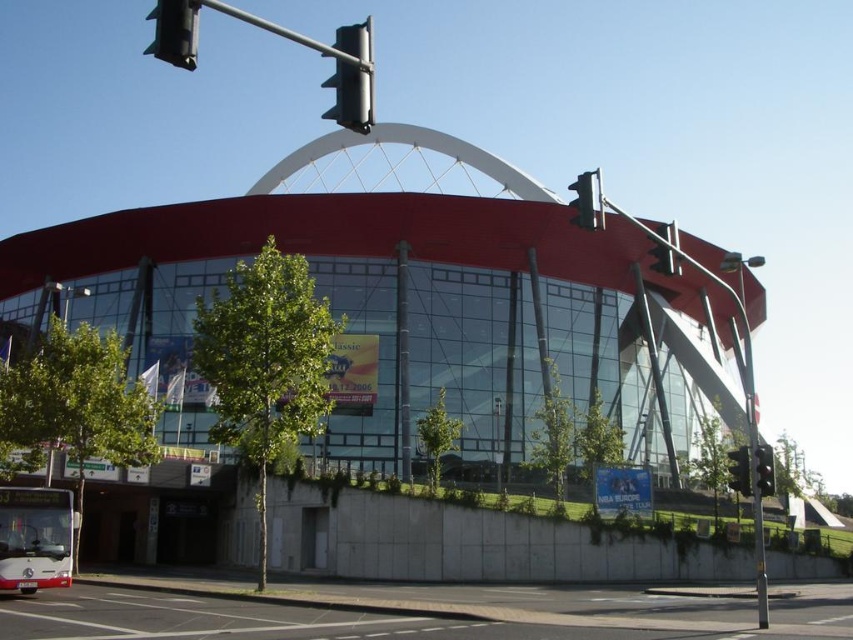
You are standing at the traffic light pole on the right side of the frame. You want to walk to the point marked as point (68,525). Which direction should you walk relative to point (589,198)?

Since point (68,525) is behind point (589,198), you should walk in the direction away from point (589,198) to reach point (68,525).

You are standing at the intersection and want to cross the street. The metallic gray traffic light at upper center is your reference point. If you walk straight towards it, will you reach it before the concrete wall partially covered with greenery?

The metallic gray traffic light at upper center is 17.86 meters from camera, so yes, you will reach it before the concrete wall partially covered with greenery since the traffic light is closer to you than the wall.

You are standing at the traffic light pole on the right side of the frame and want to walk to the entrance of the modern building with the curved red roof. Which direction should you go relative to the white matte bus at lower left?

Since the white matte bus at lower left is located at point (35, 538), you should head towards the upper right direction away from the bus to reach the entrance of the modern building with the curved red roof.